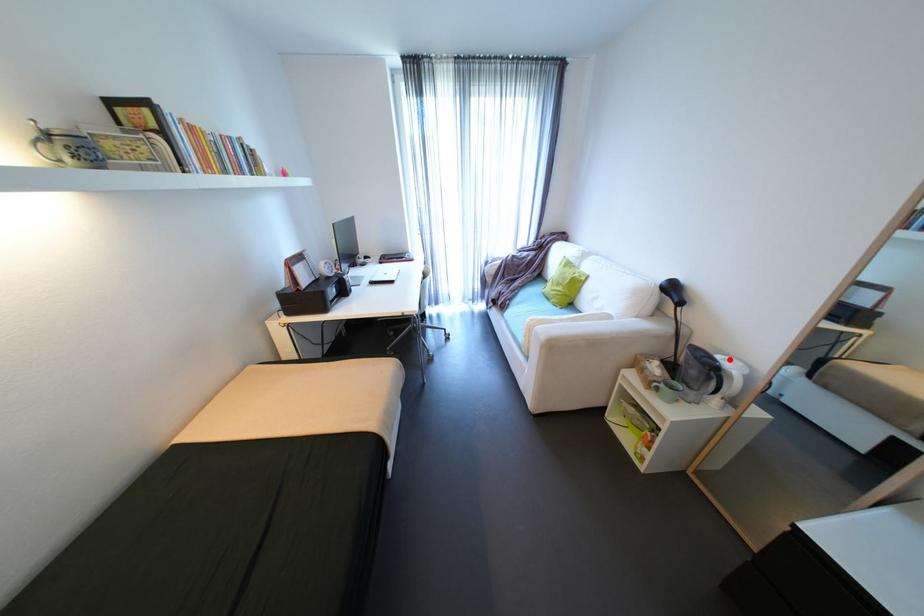
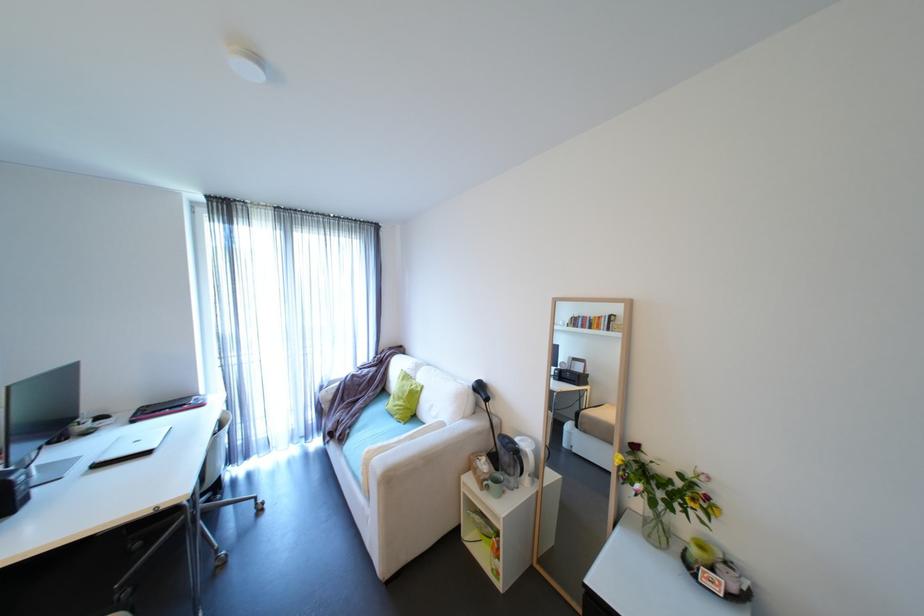
Find the pixel in the second image that matches the highlighted location in the first image.

(527, 440)